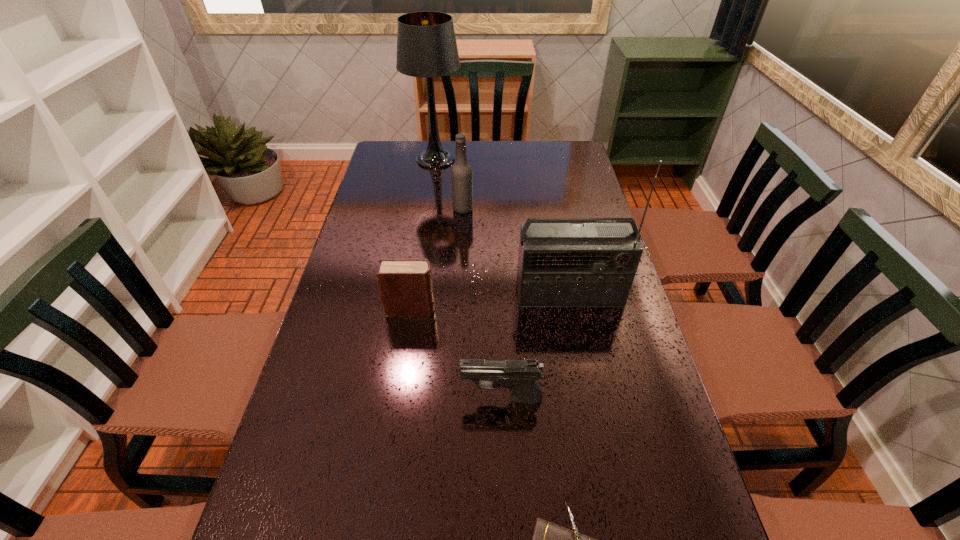
Find the location of `vacant space positioned 0.070m on the side of the fourth shortest object with the label`. vacant space positioned 0.070m on the side of the fourth shortest object with the label is located at coordinates (493, 209).

Where is `vacant space located on the spine side of the farther diary`? This screenshot has height=540, width=960. vacant space located on the spine side of the farther diary is located at coordinates (510, 309).

Where is `free spot located at the barrel of the second shortest object`? Image resolution: width=960 pixels, height=540 pixels. free spot located at the barrel of the second shortest object is located at coordinates (420, 399).

You are a GUI agent. You are given a task and a screenshot of the screen. Output one action in this format:
    pyautogui.click(x=<x>, y=<y>)
    Task: Click on the vacant space located at the barrel of the second shortest object
    
    Given the screenshot: What is the action you would take?
    pyautogui.click(x=392, y=399)

Locate an element on the screen. The width and height of the screenshot is (960, 540). vacant space located at the barrel of the second shortest object is located at coordinates (415, 399).

Where is `object located in the far edge section of the desktop`? This screenshot has width=960, height=540. object located in the far edge section of the desktop is located at coordinates (426, 44).

I want to click on table lamp that is at the left edge, so click(x=426, y=44).

Image resolution: width=960 pixels, height=540 pixels. Identify the location of diary that is at the left edge. (405, 285).

The width and height of the screenshot is (960, 540). What are the coordinates of `object that is at the right edge` in the screenshot? It's located at (593, 264).

Identify the location of object that is at the far left corner. The image size is (960, 540). (426, 44).